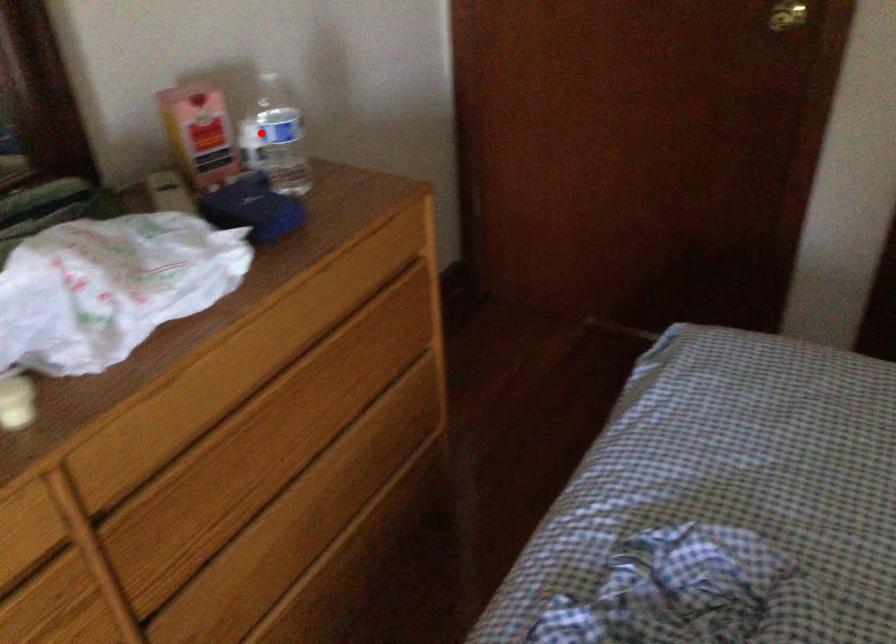
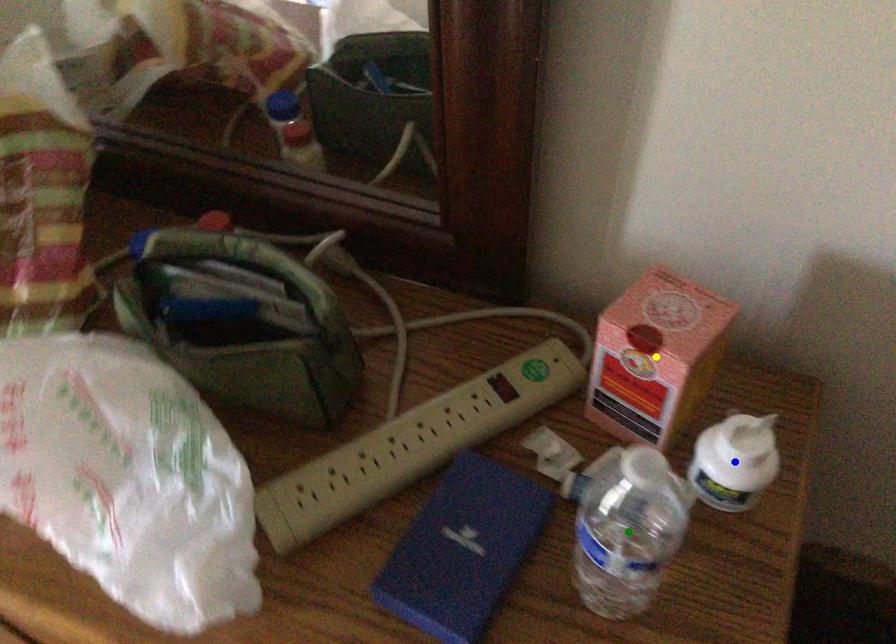
Question: I am providing you with two images of the same scene from different viewpoints. A red point is marked on the first image. You are given multiple points on the second image. Which mark in image 2 goes with the point in image 1?

Choices:
 (A) yellow point
 (B) blue point
 (C) green point

Answer: (B)